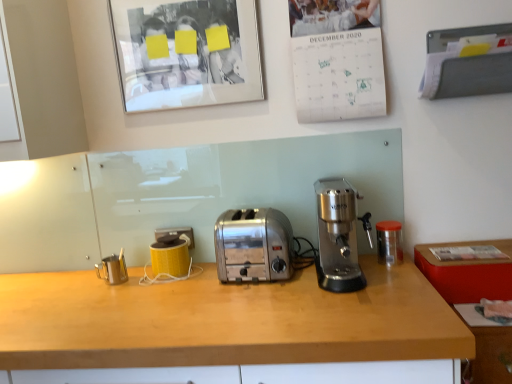
In order to click on unoccupied region to the right of brushed metal milk frother at left, which appears as the first appliance when viewed from the left in this screenshot , I will do `click(148, 278)`.